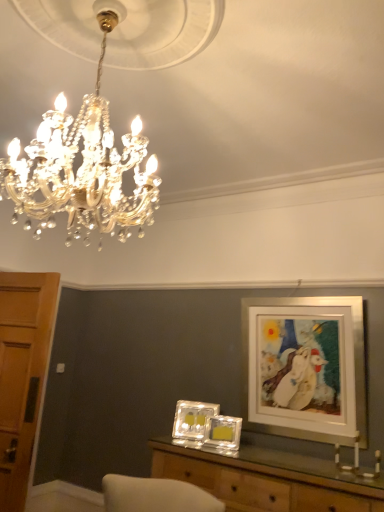
The image size is (384, 512). I want to click on translucent glass picture frame at center, the 2th picture frame viewed from the left, so click(x=223, y=432).

Measure the distance between wooden door at left and camera.

They are 9.13 feet apart.

Identify the location of translucent glass picture frame at center, the 2th picture frame viewed from the left. (223, 432).

Could you measure the distance between translucent glass picture frame at center, which appears as the 2th picture frame when viewed from the right, and wooden table at center?

translucent glass picture frame at center, which appears as the 2th picture frame when viewed from the right, is 13.79 inches away from wooden table at center.

From the image's perspective, which is above, translucent glass picture frame at center, which appears as the 2th picture frame when viewed from the right, or wooden table at center?

translucent glass picture frame at center, which appears as the 2th picture frame when viewed from the right.

Considering the sizes of objects translucent glass picture frame at center, which appears as the 2th picture frame when viewed from the right, and wooden table at center in the image provided, who is thinner, translucent glass picture frame at center, which appears as the 2th picture frame when viewed from the right, or wooden table at center?

translucent glass picture frame at center, which appears as the 2th picture frame when viewed from the right.

Considering the sizes of objects wooden door at left and gold crystal chandelier at upper center in the image provided, who is thinner, wooden door at left or gold crystal chandelier at upper center?

wooden door at left is thinner.

In the image, is wooden door at left positioned in front of or behind gold crystal chandelier at upper center?

Visually, wooden door at left is located behind gold crystal chandelier at upper center.

Which of these two, wooden door at left or gold crystal chandelier at upper center, is smaller?

With smaller size is wooden door at left.

How far apart are wooden door at left and gold crystal chandelier at upper center?

wooden door at left is 4.81 feet from gold crystal chandelier at upper center.

In the scene shown: In the image, is wooden table at center on the left side or the right side of wooden door at left?

In the image, wooden table at center appears on the right side of wooden door at left.

Which of these two, wooden table at center or wooden door at left, is wider?

With larger width is wooden table at center.

Between wooden table at center and wooden door at left, which one is positioned in front?

wooden table at center is closer to the camera.

Choose the correct answer: Is wooden table at center inside wooden door at left or outside it?

wooden table at center is not enclosed by wooden door at left.

From the image's perspective, is wooden table at center over white matte picture frame at upper right, the first picture frame from the right?

Actually, wooden table at center appears below white matte picture frame at upper right, the first picture frame from the right, in the image.

From a real-world perspective, who is located higher, wooden table at center or white matte picture frame at upper right, the 3th picture frame viewed from the left?

From a 3D spatial view, white matte picture frame at upper right, the 3th picture frame viewed from the left, is above.

Who is bigger, wooden table at center or white matte picture frame at upper right, the 3th picture frame viewed from the left?

wooden table at center.

Is wooden door at left oriented away from white matte picture frame at upper right, the first picture frame from the right?

No.

How far apart are wooden door at left and white matte picture frame at upper right, the 3th picture frame viewed from the left?

A distance of 5.98 feet exists between wooden door at left and white matte picture frame at upper right, the 3th picture frame viewed from the left.

From the image's perspective, relative to white matte picture frame at upper right, the 3th picture frame viewed from the left, is wooden door at left above or below?

wooden door at left is below white matte picture frame at upper right, the 3th picture frame viewed from the left.

Can you confirm if wooden door at left is positioned to the left of white matte picture frame at upper right, the first picture frame from the right?

Yes, wooden door at left is to the left of white matte picture frame at upper right, the first picture frame from the right.

Is clear glass picture frame at center, arranged as the third picture frame when viewed from the right, inside the boundaries of gold crystal chandelier at upper center, or outside?

clear glass picture frame at center, arranged as the third picture frame when viewed from the right, is not enclosed by gold crystal chandelier at upper center.

Between clear glass picture frame at center, arranged as the third picture frame when viewed from the right, and gold crystal chandelier at upper center, which one has more height?

With more height is gold crystal chandelier at upper center.

Can you tell me how much clear glass picture frame at center, arranged as the third picture frame when viewed from the right, and gold crystal chandelier at upper center differ in facing direction?

They differ by 113 degrees in their facing directions.

Which object is closer to the camera taking this photo, clear glass picture frame at center, arranged as the third picture frame when viewed from the right, or gold crystal chandelier at upper center?

Positioned in front is gold crystal chandelier at upper center.

Is gold crystal chandelier at upper center far from translucent glass picture frame at center, the 2th picture frame viewed from the left?

That's right, there is a large distance between gold crystal chandelier at upper center and translucent glass picture frame at center, the 2th picture frame viewed from the left.

In terms of width, does gold crystal chandelier at upper center look wider or thinner when compared to translucent glass picture frame at center, which appears as the 2th picture frame when viewed from the right?

gold crystal chandelier at upper center is wider than translucent glass picture frame at center, which appears as the 2th picture frame when viewed from the right.

Considering the relative sizes of gold crystal chandelier at upper center and translucent glass picture frame at center, which appears as the 2th picture frame when viewed from the right, in the image provided, is gold crystal chandelier at upper center shorter than translucent glass picture frame at center, which appears as the 2th picture frame when viewed from the right,?

No, gold crystal chandelier at upper center is not shorter than translucent glass picture frame at center, which appears as the 2th picture frame when viewed from the right.

Is gold crystal chandelier at upper center at the left side of translucent glass picture frame at center, which appears as the 2th picture frame when viewed from the right?

Indeed, gold crystal chandelier at upper center is positioned on the left side of translucent glass picture frame at center, which appears as the 2th picture frame when viewed from the right.

This screenshot has height=512, width=384. What are the coordinates of `table located below the translucent glass picture frame at center, which appears as the 2th picture frame when viewed from the right (from the image's perspective)` in the screenshot? It's located at (266, 478).

Identify the location of lamp located on the right of wooden door at left. This screenshot has width=384, height=512. (82, 166).

Based on their spatial positions, is translucent glass picture frame at center, which appears as the 2th picture frame when viewed from the right, or wooden door at left further from white matte picture frame at upper right, the 3th picture frame viewed from the left?

wooden door at left is further to white matte picture frame at upper right, the 3th picture frame viewed from the left.

Based on the photo, looking at the image, which one is located further to clear glass picture frame at center, arranged as the third picture frame when viewed from the right, white matte picture frame at upper right, the first picture frame from the right, or translucent glass picture frame at center, the 2th picture frame viewed from the left?

The object further to clear glass picture frame at center, arranged as the third picture frame when viewed from the right, is white matte picture frame at upper right, the first picture frame from the right.

From the image, which object appears to be nearer to clear glass picture frame at center, arranged as the third picture frame when viewed from the right, gold crystal chandelier at upper center or translucent glass picture frame at center, the 2th picture frame viewed from the left?

The object closer to clear glass picture frame at center, arranged as the third picture frame when viewed from the right, is translucent glass picture frame at center, the 2th picture frame viewed from the left.

Based on their spatial positions, is clear glass picture frame at center, the 1th picture frame positioned from the left, or translucent glass picture frame at center, which appears as the 2th picture frame when viewed from the right, further from wooden door at left?

translucent glass picture frame at center, which appears as the 2th picture frame when viewed from the right.

Which object lies nearer to the anchor point clear glass picture frame at center, arranged as the third picture frame when viewed from the right, gold crystal chandelier at upper center or white matte picture frame at upper right, the 3th picture frame viewed from the left?

white matte picture frame at upper right, the 3th picture frame viewed from the left, is positioned closer to the anchor clear glass picture frame at center, arranged as the third picture frame when viewed from the right.

Considering their positions, is white matte picture frame at upper right, the 3th picture frame viewed from the left, positioned further to wooden door at left than wooden table at center?

The object further to wooden door at left is white matte picture frame at upper right, the 3th picture frame viewed from the left.

Based on their spatial positions, is gold crystal chandelier at upper center or wooden door at left further from white matte picture frame at upper right, the 3th picture frame viewed from the left?

Among the two, gold crystal chandelier at upper center is located further to white matte picture frame at upper right, the 3th picture frame viewed from the left.

Looking at the image, which one is located further to white matte picture frame at upper right, the first picture frame from the right, clear glass picture frame at center, the 1th picture frame positioned from the left, or wooden door at left?

wooden door at left is positioned further to the anchor white matte picture frame at upper right, the first picture frame from the right.

Identify the location of picture frame between wooden door at left and translucent glass picture frame at center, which appears as the 2th picture frame when viewed from the right, from left to right. This screenshot has height=512, width=384. (192, 419).

Identify the location of picture frame located between clear glass picture frame at center, arranged as the third picture frame when viewed from the right, and white matte picture frame at upper right, the first picture frame from the right, in the left-right direction. This screenshot has width=384, height=512. (223, 432).

Where is `cabinetry between gold crystal chandelier at upper center and wooden table at center from top to bottom`? cabinetry between gold crystal chandelier at upper center and wooden table at center from top to bottom is located at coordinates (22, 374).

You are a GUI agent. You are given a task and a screenshot of the screen. Output one action in this format:
    pyautogui.click(x=<x>, y=<y>)
    Task: Click on the picture frame located between wooden table at center and translucent glass picture frame at center, which appears as the 2th picture frame when viewed from the right, in the depth direction
    This screenshot has height=512, width=384.
    Given the screenshot: What is the action you would take?
    pyautogui.click(x=304, y=367)